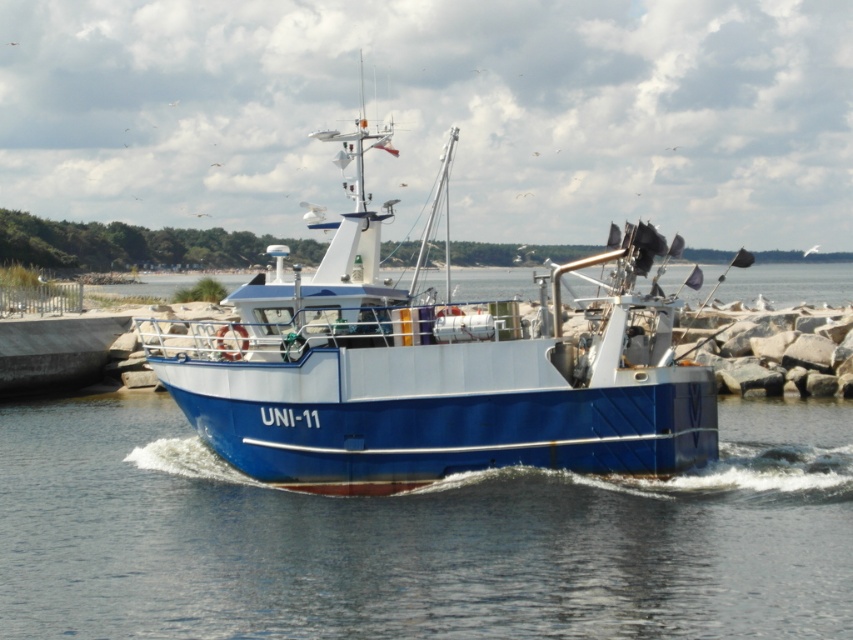
Question: Which point is farther to the camera?

Choices:
 (A) blue smooth water at center
 (B) blue matte boat at center

Answer: (B)

Question: Is blue smooth water at center to the right of blue matte boat at center from the viewer's perspective?

Choices:
 (A) yes
 (B) no

Answer: (A)

Question: Is blue smooth water at center below blue matte boat at center?

Choices:
 (A) no
 (B) yes

Answer: (B)

Question: Is blue smooth water at center to the right of blue matte boat at center from the viewer's perspective?

Choices:
 (A) yes
 (B) no

Answer: (A)